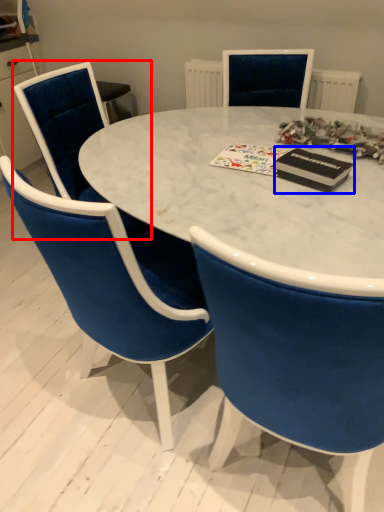
Question: Which of the following is the closest to the observer, chair (highlighted by a red box) or magazine (highlighted by a blue box)?

Choices:
 (A) chair
 (B) magazine

Answer: (B)